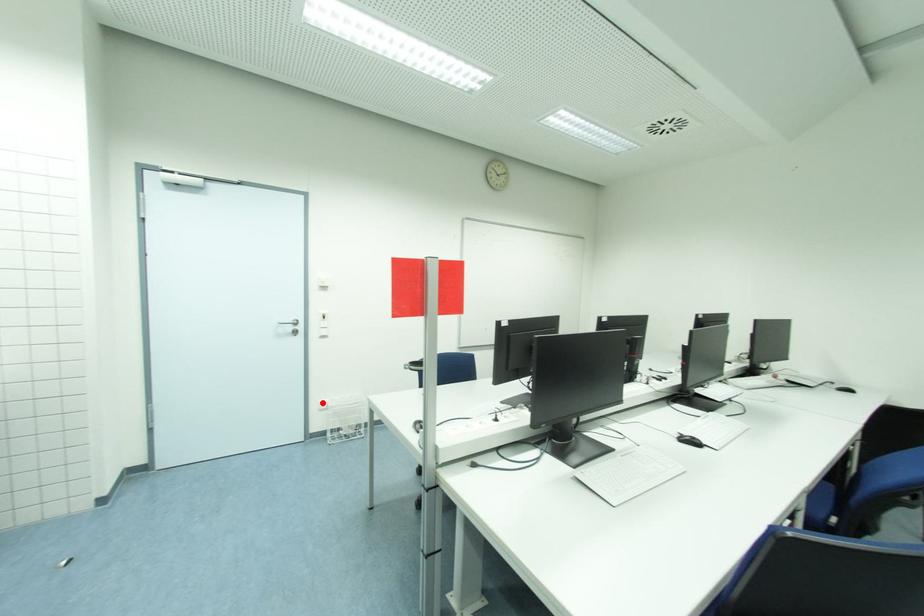
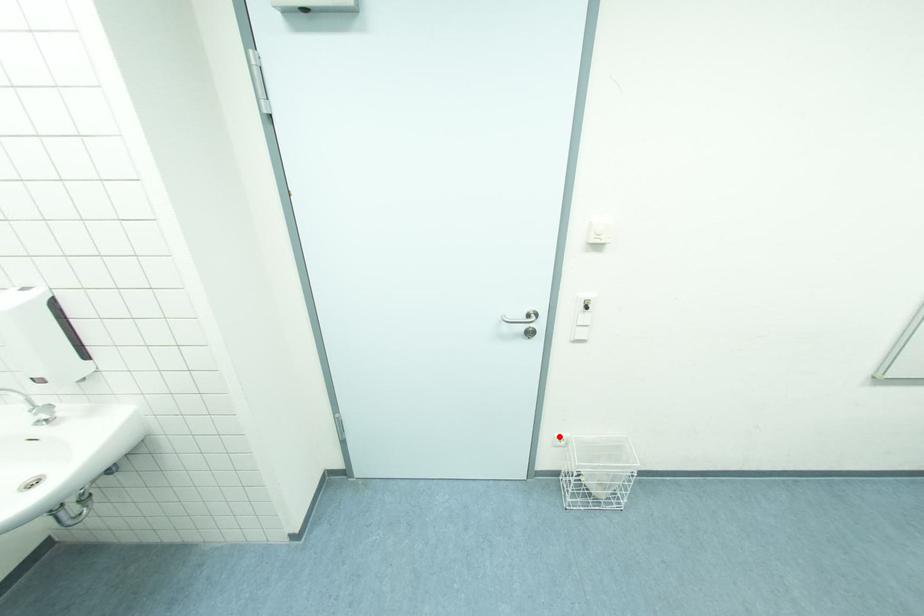
I am providing you with two images of the same scene from different viewpoints. A red point is marked on the first image and another point is marked on the second image. Do the highlighted points in image1 and image2 indicate the same real-world spot?

Yes